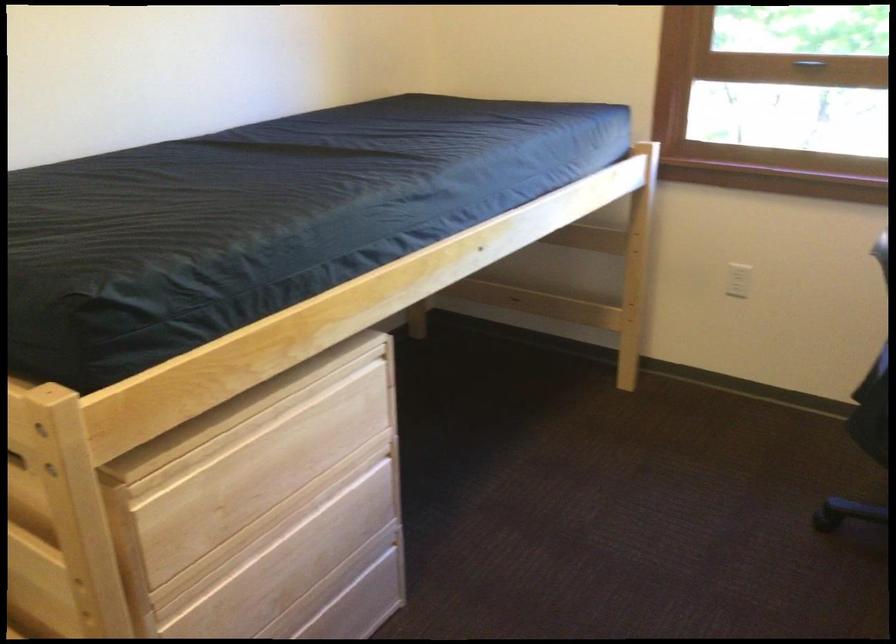
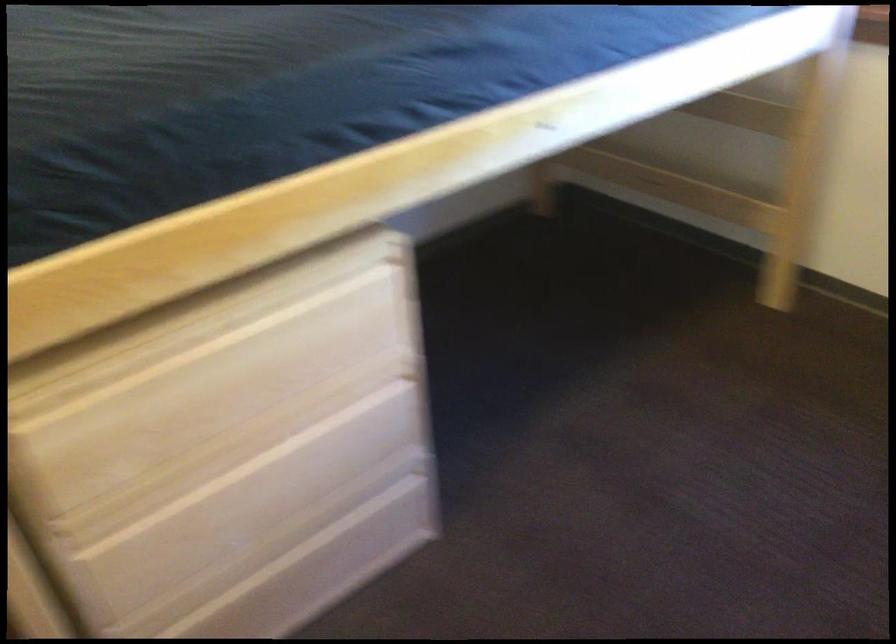
Question: Based on the continuous images, in which direction is the camera rotating? Reply with the corresponding letter.

Choices:
 (A) Left
 (B) Right
 (C) Up
 (D) Down

Answer: (A)